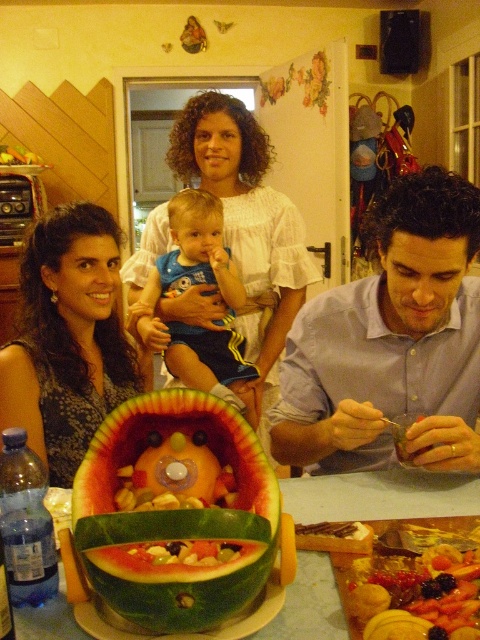
Question: Does watermelon with fruit inside at center have a smaller size compared to matte black dress at center?

Choices:
 (A) yes
 (B) no

Answer: (A)

Question: Which is nearer to the watermelon with fruit inside at center?

Choices:
 (A) white cotton dress at center
 (B) matte blue shirt at center
 (C) matte black dress at center
 (D) smooth wooden table at center

Answer: (D)

Question: Does watermelon with fruit inside at center have a greater width compared to smooth wooden table at center?

Choices:
 (A) no
 (B) yes

Answer: (A)

Question: Which of the following is the farthest from the observer?

Choices:
 (A) blue denim shorts at center
 (B) green matte watermelon at center

Answer: (A)

Question: Which object is farther from the camera taking this photo?

Choices:
 (A) white cotton dress at center
 (B) green matte watermelon at center
 (C) matte black dress at center

Answer: (A)

Question: Does matte blue shirt at center have a greater width compared to watermelon with fruit inside at center?

Choices:
 (A) no
 (B) yes

Answer: (B)